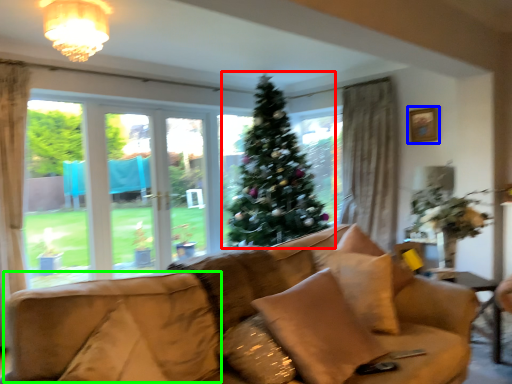
Question: Which object is positioned farthest from christmas tree (highlighted by a red box)? Select from picture frame (highlighted by a blue box) and swivel chair (highlighted by a green box).

Choices:
 (A) picture frame
 (B) swivel chair

Answer: (B)